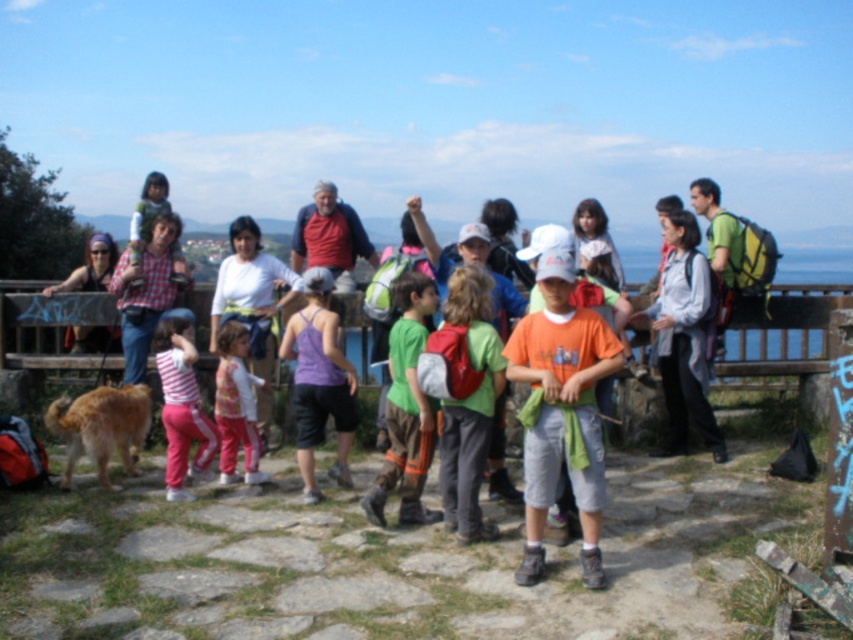
Question: Among these points, which one is farthest from the camera?

Choices:
 (A) (103, 342)
 (B) (389, 364)
 (C) (460, 268)

Answer: (A)

Question: Among these points, which one is farthest from the camera?

Choices:
 (A) (444, 481)
 (B) (177, 388)
 (C) (257, 333)

Answer: (C)

Question: Can you confirm if green matte backpack at center is thinner than matte plaid shirt at center?

Choices:
 (A) no
 (B) yes

Answer: (B)

Question: Can you confirm if matte plaid shirt at center is positioned below matte black sunglasses at center?

Choices:
 (A) no
 (B) yes

Answer: (B)

Question: Which is farther from the matte plaid shirt at center?

Choices:
 (A) orange cotton shirt at center
 (B) matte black sunglasses at center
 (C) striped cotton shirt at center
 (D) pink fabric pants at center

Answer: (A)

Question: Is the position of light gray fabric jacket at center less distant than that of striped cotton shirt at center?

Choices:
 (A) yes
 (B) no

Answer: (B)